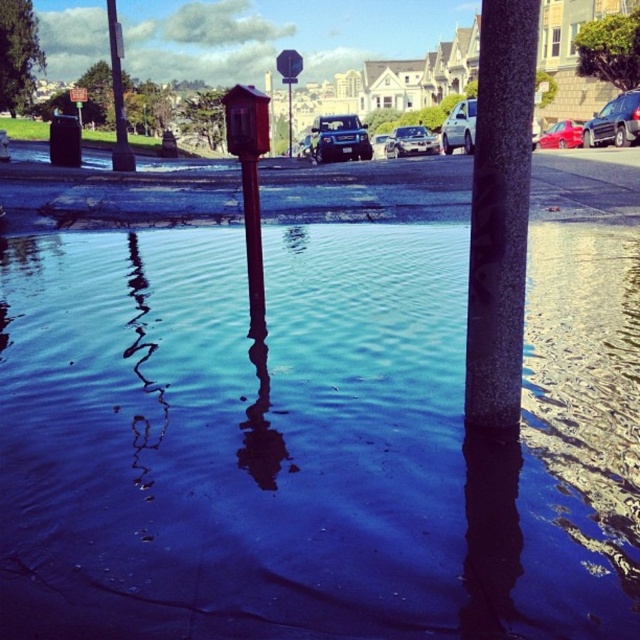
Who is positioned more to the right, brushed metal pole at upper left or silver metallic sedan at center?

Positioned to the right is silver metallic sedan at center.

Is point (109, 19) behind point (448, 154)?

No, it is not.

Find the location of `brushed metal pole at upper left`. brushed metal pole at upper left is located at coordinates (116, 93).

What do you see at coordinates (460, 128) in the screenshot? I see `silver metallic sedan at center` at bounding box center [460, 128].

In the scene shown: Is silver metallic sedan at center to the left of shiny silver sedan at center from the viewer's perspective?

No, silver metallic sedan at center is not to the left of shiny silver sedan at center.

Is point (454, 108) farther from camera compared to point (436, 141)?

Yes, point (454, 108) is farther from viewer.

This screenshot has width=640, height=640. In order to click on silver metallic sedan at center in this screenshot , I will do point(460,128).

Does point (602, 138) come in front of point (435, 145)?

That is True.

Based on the photo, between satin black suv at upper right and shiny silver sedan at center, which one appears on the right side from the viewer's perspective?

Positioned to the right is satin black suv at upper right.

Is point (625, 131) positioned after point (433, 147)?

That is False.

This screenshot has height=640, width=640. I want to click on satin black suv at upper right, so click(614, 122).